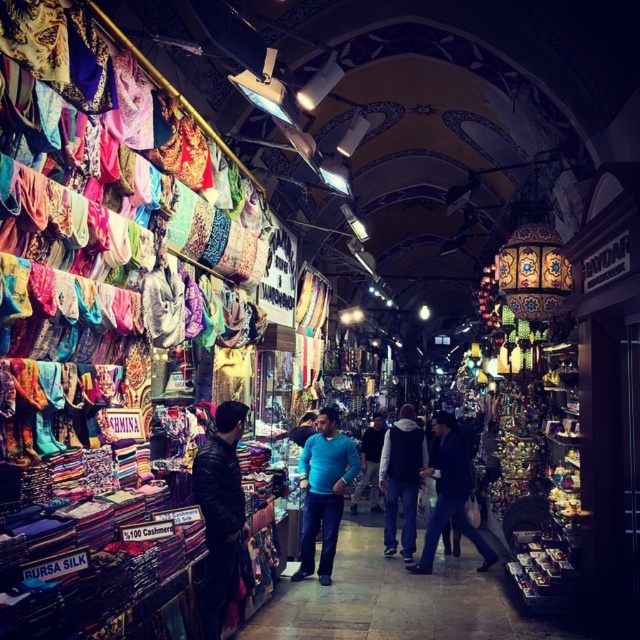
Which is above, black leather jacket at center or dark blue jeans at center?

black leather jacket at center is above.

Between black leather jacket at center and dark blue jeans at center, which one is positioned lower?

Positioned lower is dark blue jeans at center.

Between point (193, 490) and point (401, 413), which one is positioned behind?

Point (401, 413)

At what (x,y) coordinates should I click in order to perform the action: click on black leather jacket at center. Please return your answer as a coordinate pair (x, y). The image size is (640, 640). Looking at the image, I should click on [220, 513].

Does blue matte shirt at center appear on the right side of blue denim jacket at center?

Incorrect, blue matte shirt at center is not on the right side of blue denim jacket at center.

This screenshot has height=640, width=640. What do you see at coordinates (323, 492) in the screenshot?
I see `blue matte shirt at center` at bounding box center [323, 492].

Locate an element on the screen. blue matte shirt at center is located at coordinates (323, 492).

What do you see at coordinates (220, 513) in the screenshot?
I see `black leather jacket at center` at bounding box center [220, 513].

Can you confirm if black leather jacket at center is positioned to the left of blue matte shirt at center?

Indeed, black leather jacket at center is positioned on the left side of blue matte shirt at center.

Is point (209, 444) farther from camera compared to point (339, 512)?

That is False.

You are a GUI agent. You are given a task and a screenshot of the screen. Output one action in this format:
    pyautogui.click(x=<x>, y=<y>)
    Task: Click on the black leather jacket at center
    
    Given the screenshot: What is the action you would take?
    pyautogui.click(x=220, y=513)